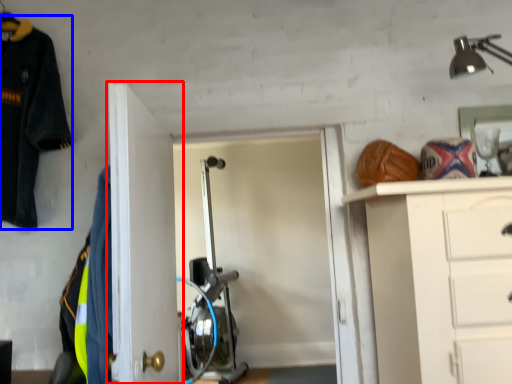
Question: Which object is closer to the camera taking this photo, door (highlighted by a red box) or uniform (highlighted by a blue box)?

Choices:
 (A) door
 (B) uniform

Answer: (A)